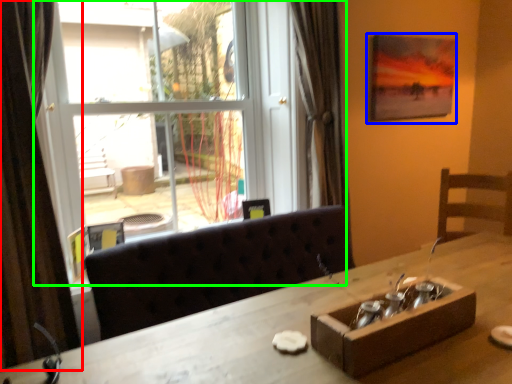
Question: Which is nearer to the curtain (highlighted by a red box)? picture frame (highlighted by a blue box) or window (highlighted by a green box).

Choices:
 (A) picture frame
 (B) window

Answer: (B)